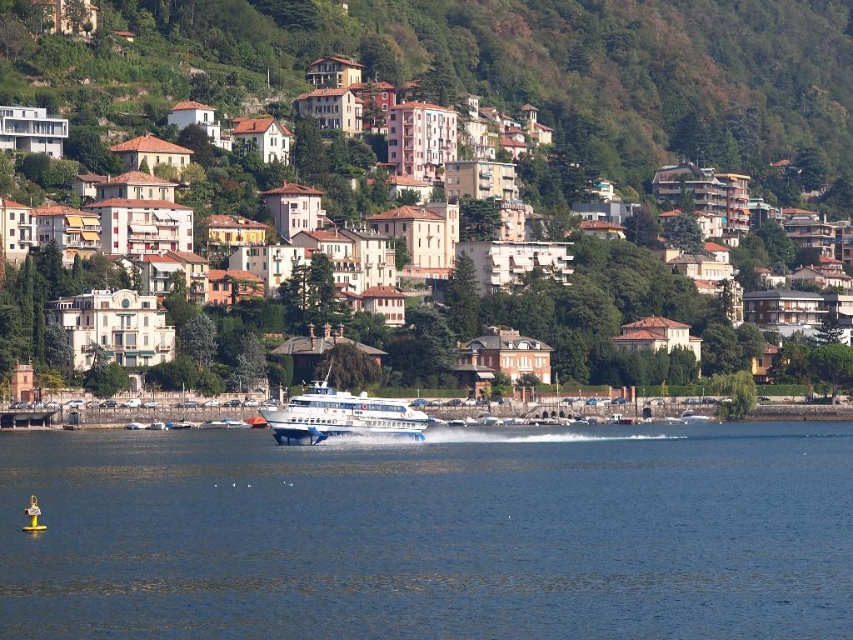
You are standing on the dock and see the blue water at center and the white matte buildings at center. Which object is positioned to the left?

The blue water at center is to the left of the white matte buildings at center.

You are a tourist standing on the lakeside and want to take a photo of both the white matte buildings at center and the white glossy cruise ship at center. Which object should you focus on first to ensure both are in the frame?

You should focus on the white matte buildings at center first because they are closer to you than the white glossy cruise ship at center, ensuring both are in the frame.

You are a tour guide planning a boat tour and need to ensure the cruise ship can safely approach the buildings. Given that the minimum safe distance required for the cruise ship to maneuver comfortably is 50 meters, can the white glossy cruise ship at center safely approach the white matte buildings at center?

The distance between the white glossy cruise ship at center and the white matte buildings at center is 53.25 meters, which exceeds the minimum safe distance of 50 meters. Therefore, the white glossy cruise ship at center can safely approach the white matte buildings at center.